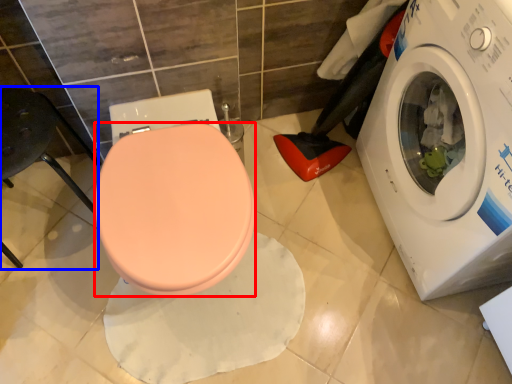
Question: Which of the following is the closest to the observer, bidet (highlighted by a red box) or chair (highlighted by a blue box)?

Choices:
 (A) bidet
 (B) chair

Answer: (A)